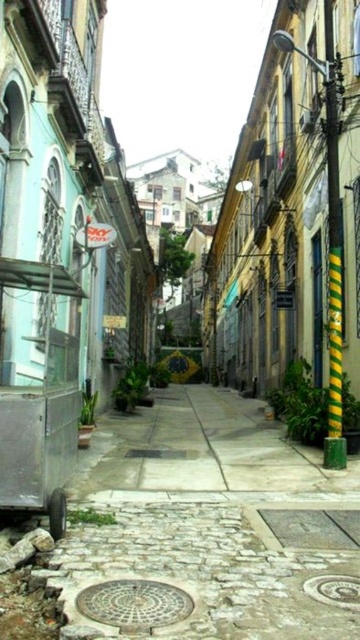
Which is behind, point (331, 102) or point (307, 593)?

The point (331, 102) is more distant.

The height and width of the screenshot is (640, 360). What do you see at coordinates (333, 260) in the screenshot?
I see `yellow-green striped pole at right` at bounding box center [333, 260].

At what (x,y) coordinates should I click in order to perform the action: click on yellow-green striped pole at right. Please return your answer as a coordinate pair (x, y). The image size is (360, 640). Looking at the image, I should click on (333, 260).

Is yellow-green striped pole at right positioned behind metallic textured manhole cover at center?

Yes, it is behind metallic textured manhole cover at center.

Looking at this image, which is more to the left, yellow-green striped pole at right or metallic textured manhole cover at center?

Positioned to the left is metallic textured manhole cover at center.

The height and width of the screenshot is (640, 360). Identify the location of yellow-green striped pole at right. (333, 260).

Who is positioned more to the right, metallic textured manhole cover at center or metallic circular manhole cover at lower center?

metallic circular manhole cover at lower center is more to the right.

Consider the image. Is metallic textured manhole cover at center further to the viewer compared to metallic circular manhole cover at lower center?

No, it is not.

Is point (110, 611) farther from viewer compared to point (326, 586)?

No, it is not.

Identify the location of metallic textured manhole cover at center. This screenshot has height=640, width=360. (135, 604).